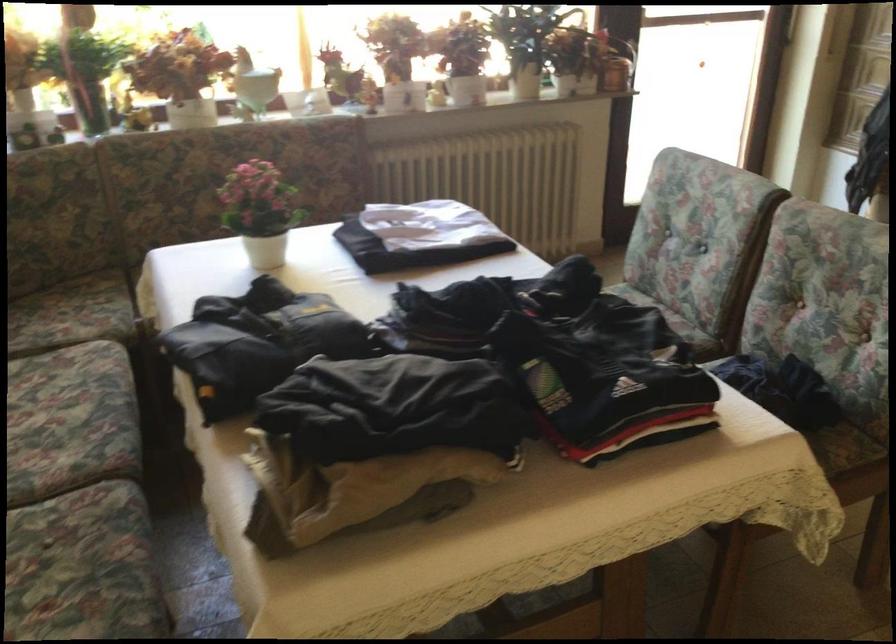
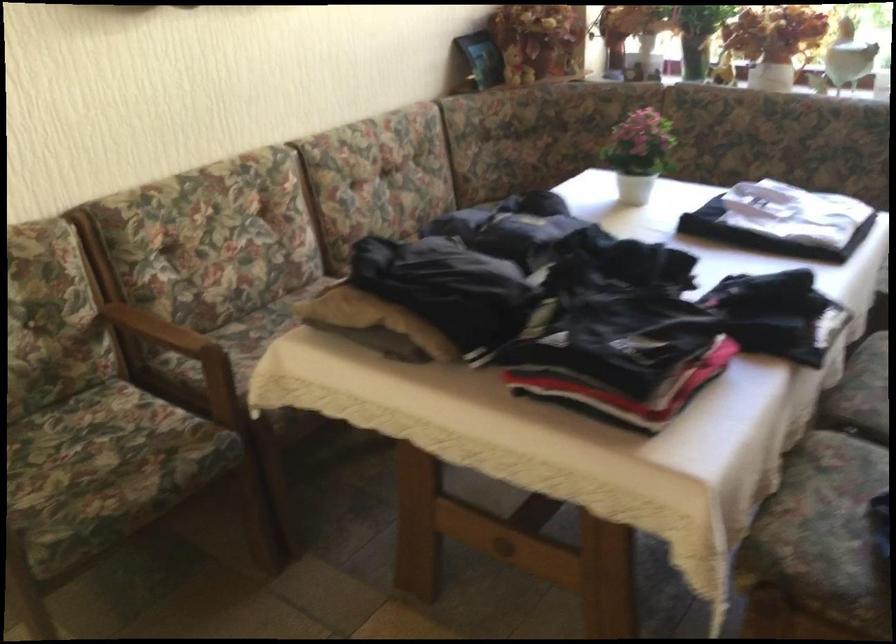
Find the pixel in the second image that matches (x=595, y=359) in the first image.

(589, 317)